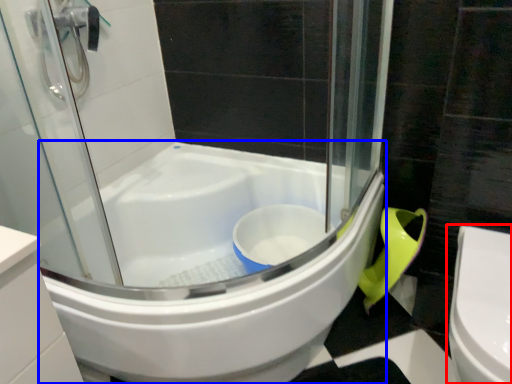
Question: Which of the following is the farthest to the observer, toilet (highlighted by a red box) or bathtub (highlighted by a blue box)?

Choices:
 (A) toilet
 (B) bathtub

Answer: (B)